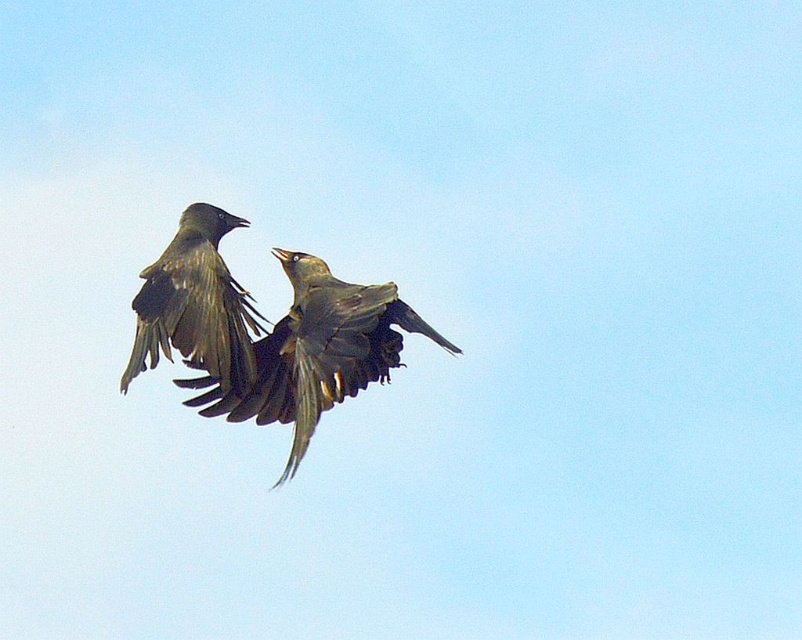
Is dark gray feathers at center positioned before dark gray feathers at upper left?

Yes, dark gray feathers at center is closer to the viewer.

The width and height of the screenshot is (802, 640). I want to click on dark gray feathers at center, so click(318, 352).

Locate an element on the screen. dark gray feathers at center is located at coordinates (318, 352).